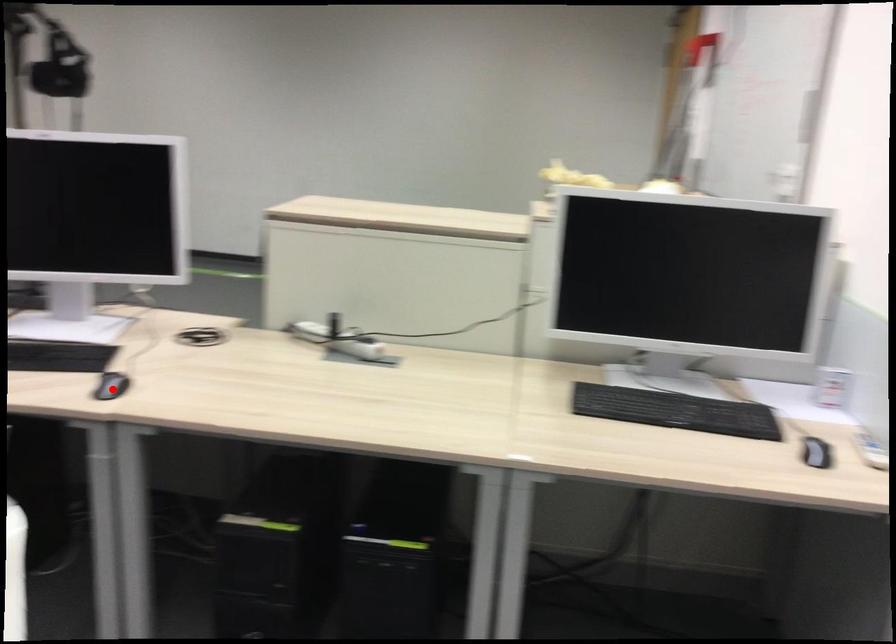
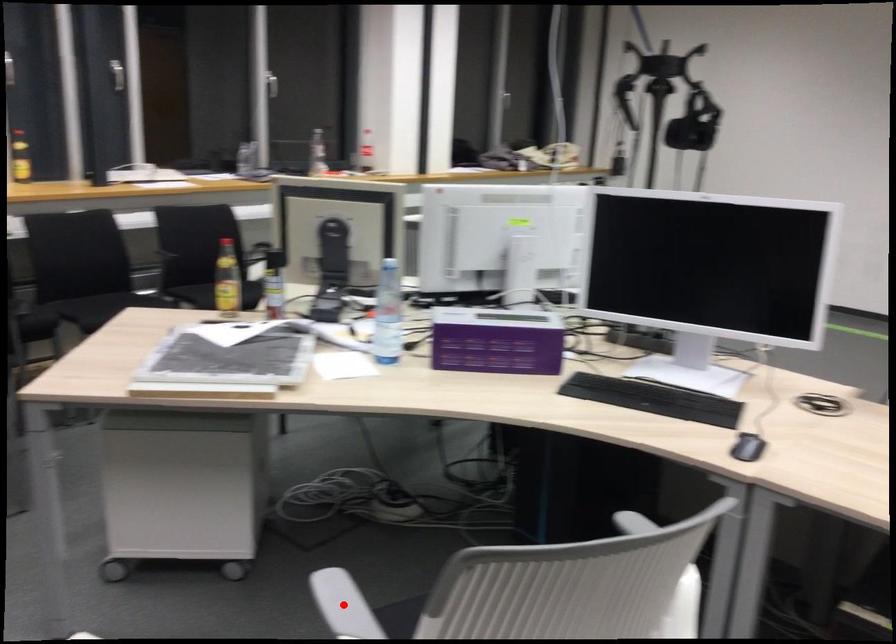
Looking at this image, I am providing you with two images of the same scene from different viewpoints. A red point is marked on the first image and another point is marked on the second image. Is the marked point in image1 the same physical position as the marked point in image2?

No